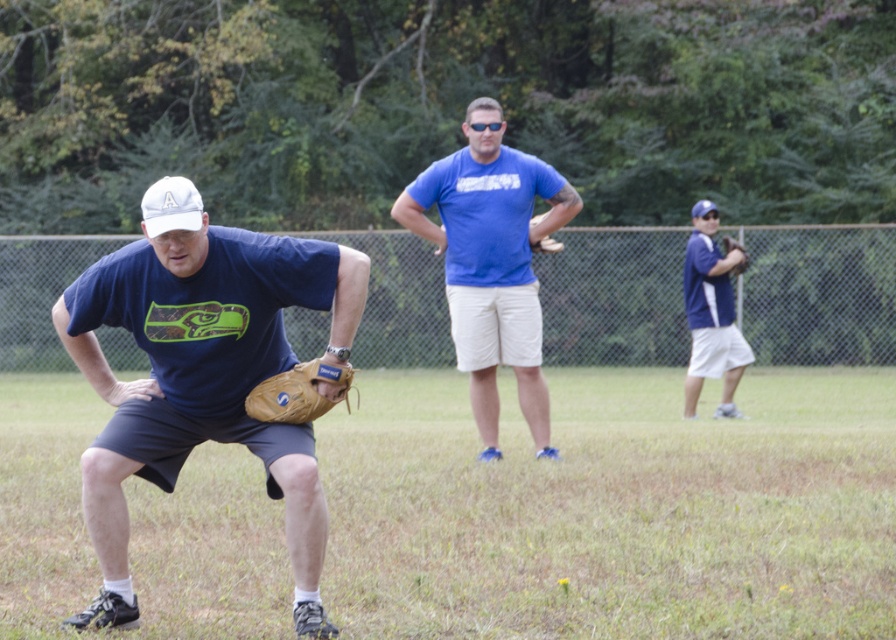
Question: Which object is closer to the camera taking this photo?

Choices:
 (A) dark blue baseball glove at center
 (B) blue fabric baseball glove at right
 (C) white matte baseball cap at left
 (D) brown leather glove at center

Answer: (C)

Question: Can you confirm if dark blue baseball glove at center is smaller than brown leather baseball glove at center?

Choices:
 (A) no
 (B) yes

Answer: (A)

Question: Is dark blue baseball glove at center above brown leather baseball glove at center?

Choices:
 (A) yes
 (B) no

Answer: (B)

Question: Among these points, which one is farthest from the camera?

Choices:
 (A) (48, 564)
 (B) (720, 404)

Answer: (B)

Question: Can you confirm if matte blue t-shirt at left is smaller than blue fabric baseball glove at right?

Choices:
 (A) yes
 (B) no

Answer: (B)

Question: Which object appears closest to the camera in this image?

Choices:
 (A) dark blue baseball glove at center
 (B) brown leather baseball glove at center
 (C) blue cotton shirt at center

Answer: (B)